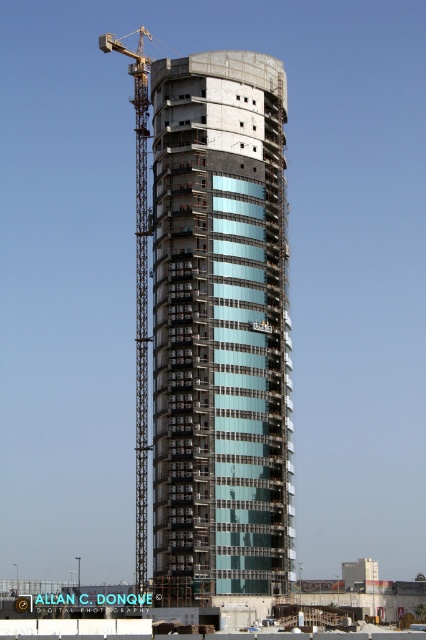
Question: Can you confirm if clear glass building at center is thinner than yellow metal crane at left?

Choices:
 (A) no
 (B) yes

Answer: (B)

Question: Estimate the real-world distances between objects in this image. Which object is farther from the yellow metal crane at left?

Choices:
 (A) transparent glass building at center
 (B) clear glass building at center

Answer: (A)

Question: Among these objects, which one is farthest from the camera?

Choices:
 (A) transparent glass building at center
 (B) yellow metal crane at left
 (C) clear glass building at center

Answer: (B)

Question: Which point appears farthest from the camera in this image?

Choices:
 (A) (213, 563)
 (B) (146, 70)

Answer: (B)

Question: Where is clear glass building at center located in relation to transparent glass building at center in the image?

Choices:
 (A) right
 (B) left

Answer: (A)

Question: Can you confirm if yellow metal crane at left is smaller than transparent glass building at center?

Choices:
 (A) yes
 (B) no

Answer: (B)